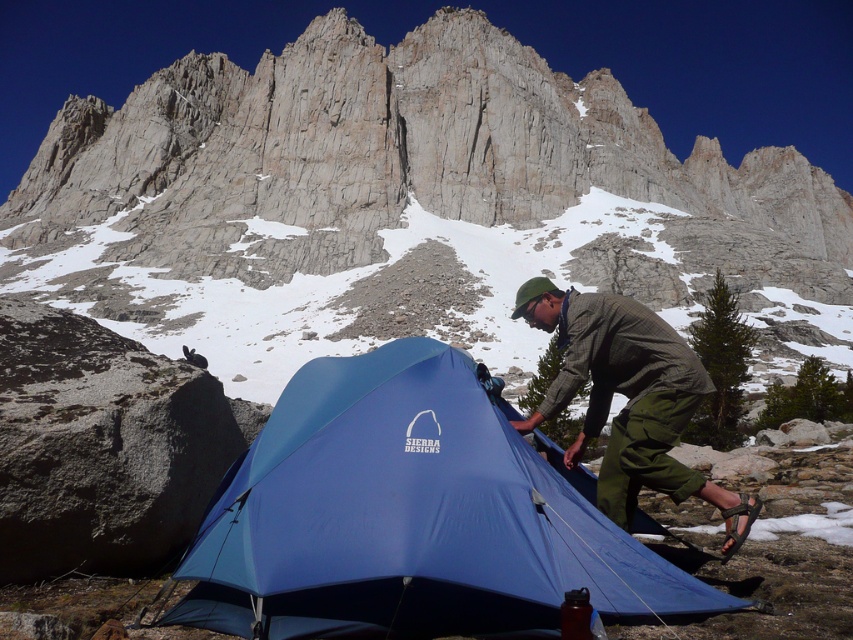
Is the position of blue nylon tent at center more distant than that of green plaid shirt at center?

No, blue nylon tent at center is closer to the viewer.

Describe the element at coordinates (410, 515) in the screenshot. I see `blue nylon tent at center` at that location.

This screenshot has width=853, height=640. Find the location of `blue nylon tent at center`. blue nylon tent at center is located at coordinates (410, 515).